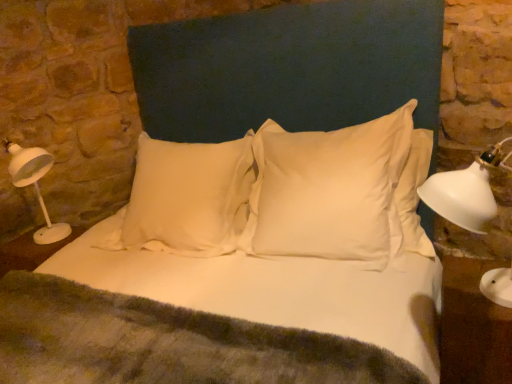
The height and width of the screenshot is (384, 512). What are the coordinates of `white plastic table lamp at left` in the screenshot? It's located at (35, 186).

What do you see at coordinates (187, 198) in the screenshot?
I see `white satin pillow at center, positioned as the first pillow in left-to-right order` at bounding box center [187, 198].

What do you see at coordinates (473, 326) in the screenshot? I see `white glossy table at lower right` at bounding box center [473, 326].

In order to face white glossy table at lower right, should I rotate leftwards or rightwards?

A 27.783 degree turn to the right will do.

The height and width of the screenshot is (384, 512). I want to click on white smooth pillow at center, placed as the first pillow when sorted from right to left, so click(329, 191).

Considering the positions of points (298, 236) and (466, 259), is point (298, 236) closer to camera compared to point (466, 259)?

Yes.

From their relative heights in the image, would you say white smooth pillow at center, placed as the first pillow when sorted from right to left, is taller or shorter than white glossy table at lower right?

white smooth pillow at center, placed as the first pillow when sorted from right to left, is taller than white glossy table at lower right.

Considering the sizes of objects white smooth pillow at center, the second pillow viewed from the left, and white glossy table at lower right in the image provided, who is wider, white smooth pillow at center, the second pillow viewed from the left, or white glossy table at lower right?

With larger width is white smooth pillow at center, the second pillow viewed from the left.

Could you tell me if white smooth pillow at center, the second pillow viewed from the left, is turned towards white glossy table at lower right?

No, white smooth pillow at center, the second pillow viewed from the left, is not oriented towards white glossy table at lower right.

Is white fabric headboard at center shorter than white plastic table lamp at left?

No.

From a real-world perspective, is white fabric headboard at center above or below white plastic table lamp at left?

white fabric headboard at center is below white plastic table lamp at left.

Is white fabric headboard at center oriented towards white plastic table lamp at left?

No, white fabric headboard at center is not turned towards white plastic table lamp at left.

From the image's perspective, is white fabric headboard at center above white plastic table lamp at left?

Yes, from the image's perspective, white fabric headboard at center is on top of white plastic table lamp at left.

From the picture: What's the angular difference between white fabric headboard at center and white satin pillow at center, positioned as the first pillow in left-to-right order,'s facing directions?

The angular difference between white fabric headboard at center and white satin pillow at center, positioned as the first pillow in left-to-right order, is 5.99 degrees.

From the image's perspective, between white fabric headboard at center and white satin pillow at center, positioned as the first pillow in left-to-right order, which one is located above?

white fabric headboard at center.

Between white fabric headboard at center and white satin pillow at center, marked as the second pillow in a right-to-left arrangement, which one has more height?

white fabric headboard at center.

Considering the relative sizes of white fabric headboard at center and white smooth pillow at center, placed as the first pillow when sorted from right to left, in the image provided, is white fabric headboard at center thinner than white smooth pillow at center, placed as the first pillow when sorted from right to left,?

Incorrect, the width of white fabric headboard at center is not less than that of white smooth pillow at center, placed as the first pillow when sorted from right to left.

How many degrees apart are the facing directions of white fabric headboard at center and white smooth pillow at center, the second pillow viewed from the left?

The angle between the facing direction of white fabric headboard at center and the facing direction of white smooth pillow at center, the second pillow viewed from the left, is 5.99 degrees.

Is the position of white fabric headboard at center more distant than that of white smooth pillow at center, placed as the first pillow when sorted from right to left?

No, white fabric headboard at center is in front of white smooth pillow at center, placed as the first pillow when sorted from right to left.

Considering the relative sizes of white satin pillow at center, positioned as the first pillow in left-to-right order, and white fabric headboard at center in the image provided, is white satin pillow at center, positioned as the first pillow in left-to-right order, wider than white fabric headboard at center?

In fact, white satin pillow at center, positioned as the first pillow in left-to-right order, might be narrower than white fabric headboard at center.

Based on their sizes in the image, would you say white satin pillow at center, marked as the second pillow in a right-to-left arrangement, is bigger or smaller than white fabric headboard at center?

In the image, white satin pillow at center, marked as the second pillow in a right-to-left arrangement, appears to be smaller than white fabric headboard at center.

Are white satin pillow at center, positioned as the first pillow in left-to-right order, and white fabric headboard at center beside each other?

They are not placed beside each other.

From the image's perspective, does white satin pillow at center, positioned as the first pillow in left-to-right order, appear lower than white fabric headboard at center?

Yes, from the image's perspective, white satin pillow at center, positioned as the first pillow in left-to-right order, is beneath white fabric headboard at center.

Based on the photo, between white satin pillow at center, positioned as the first pillow in left-to-right order, and white glossy table at lower right, which one has smaller size?

Smaller between the two is white glossy table at lower right.

Are white satin pillow at center, marked as the second pillow in a right-to-left arrangement, and white glossy table at lower right located far from each other?

Indeed, white satin pillow at center, marked as the second pillow in a right-to-left arrangement, is not near white glossy table at lower right.

Is white satin pillow at center, marked as the second pillow in a right-to-left arrangement, wider or thinner than white glossy table at lower right?

Considering their sizes, white satin pillow at center, marked as the second pillow in a right-to-left arrangement, looks broader than white glossy table at lower right.

Which object is further away from the camera, white satin pillow at center, positioned as the first pillow in left-to-right order, or white glossy table at lower right?

Positioned behind is white satin pillow at center, positioned as the first pillow in left-to-right order.

Considering the positions of points (466, 267) and (19, 173), is point (466, 267) closer to camera compared to point (19, 173)?

That is True.

In the image, is white glossy table at lower right positioned in front of or behind white plastic table lamp at left?

In the image, white glossy table at lower right appears in front of white plastic table lamp at left.

Which of these two, white glossy table at lower right or white plastic table lamp at left, is thinner?

With smaller width is white glossy table at lower right.

Would you say white glossy table at lower right is a long distance from white plastic table lamp at left?

Yes.

Which pillow is the 1st one when counting from the back of the white glossy table at lower right? Please provide its 2D coordinates.

[(329, 191)]

The height and width of the screenshot is (384, 512). Find the location of `table lamp located above the white fabric headboard at center (from a real-world perspective)`. table lamp located above the white fabric headboard at center (from a real-world perspective) is located at coordinates (35, 186).

Estimate the real-world distances between objects in this image. Which object is closer to white fabric headboard at center, white satin pillow at center, marked as the second pillow in a right-to-left arrangement, or white smooth pillow at center, placed as the first pillow when sorted from right to left?

The object closer to white fabric headboard at center is white smooth pillow at center, placed as the first pillow when sorted from right to left.

Looking at the image, which one is located closer to white smooth pillow at center, placed as the first pillow when sorted from right to left, white glossy table at lower right or white satin pillow at center, positioned as the first pillow in left-to-right order?

white satin pillow at center, positioned as the first pillow in left-to-right order, is positioned closer to the anchor white smooth pillow at center, placed as the first pillow when sorted from right to left.

Estimate the real-world distances between objects in this image. Which object is further from white smooth pillow at center, the second pillow viewed from the left, white satin pillow at center, marked as the second pillow in a right-to-left arrangement, or white glossy table at lower right?

Among the two, white glossy table at lower right is located further to white smooth pillow at center, the second pillow viewed from the left.

Which object lies further to the anchor point white plastic table lamp at left, white glossy table at lower right or white smooth pillow at center, the second pillow viewed from the left?

The object further to white plastic table lamp at left is white glossy table at lower right.

From the image, which object appears to be farther from white plastic table lamp at left, white satin pillow at center, marked as the second pillow in a right-to-left arrangement, or white fabric headboard at center?

white fabric headboard at center is positioned further to the anchor white plastic table lamp at left.

Looking at the image, which one is located closer to white plastic table lamp at left, white glossy table at lower right or white satin pillow at center, positioned as the first pillow in left-to-right order?

white satin pillow at center, positioned as the first pillow in left-to-right order, is closer to white plastic table lamp at left.

Which object lies further to the anchor point white smooth pillow at center, placed as the first pillow when sorted from right to left, white plastic table lamp at left or white fabric headboard at center?

The object further to white smooth pillow at center, placed as the first pillow when sorted from right to left, is white plastic table lamp at left.

Looking at the image, which one is located closer to white fabric headboard at center, white smooth pillow at center, placed as the first pillow when sorted from right to left, or white satin pillow at center, marked as the second pillow in a right-to-left arrangement?

The object closer to white fabric headboard at center is white smooth pillow at center, placed as the first pillow when sorted from right to left.

This screenshot has width=512, height=384. I want to click on headboard between white satin pillow at center, positioned as the first pillow in left-to-right order, and white smooth pillow at center, the second pillow viewed from the left, so click(288, 68).

The height and width of the screenshot is (384, 512). Find the location of `pillow located between white plastic table lamp at left and white smooth pillow at center, placed as the first pillow when sorted from right to left, in the left-right direction`. pillow located between white plastic table lamp at left and white smooth pillow at center, placed as the first pillow when sorted from right to left, in the left-right direction is located at coordinates (187, 198).

Locate an element on the screen. The image size is (512, 384). pillow situated between white satin pillow at center, positioned as the first pillow in left-to-right order, and white glossy table at lower right from left to right is located at coordinates (329, 191).

Where is `pillow between white plastic table lamp at left and white fabric headboard at center from left to right`? pillow between white plastic table lamp at left and white fabric headboard at center from left to right is located at coordinates (187, 198).